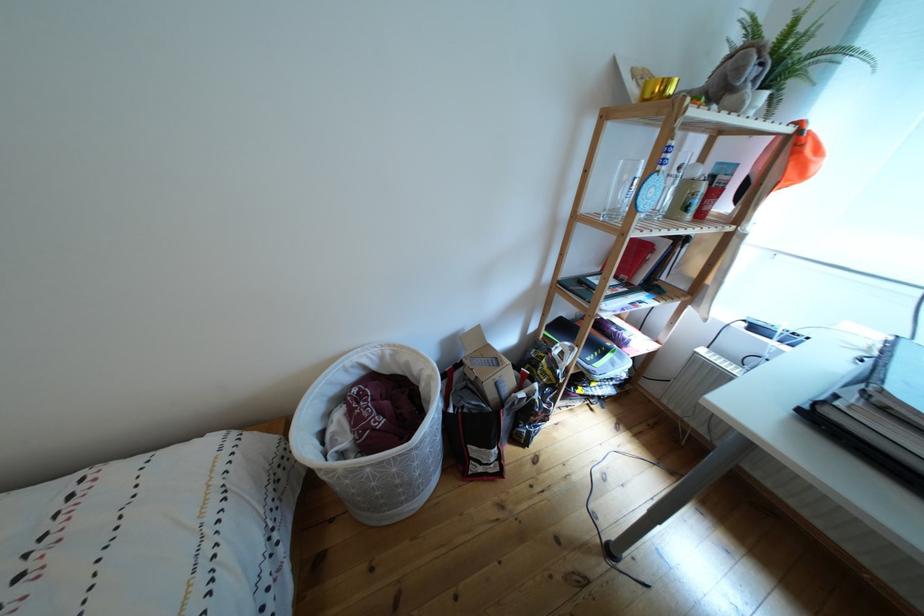
Locate an element on the screen. clear drinking glass is located at coordinates (622, 188).